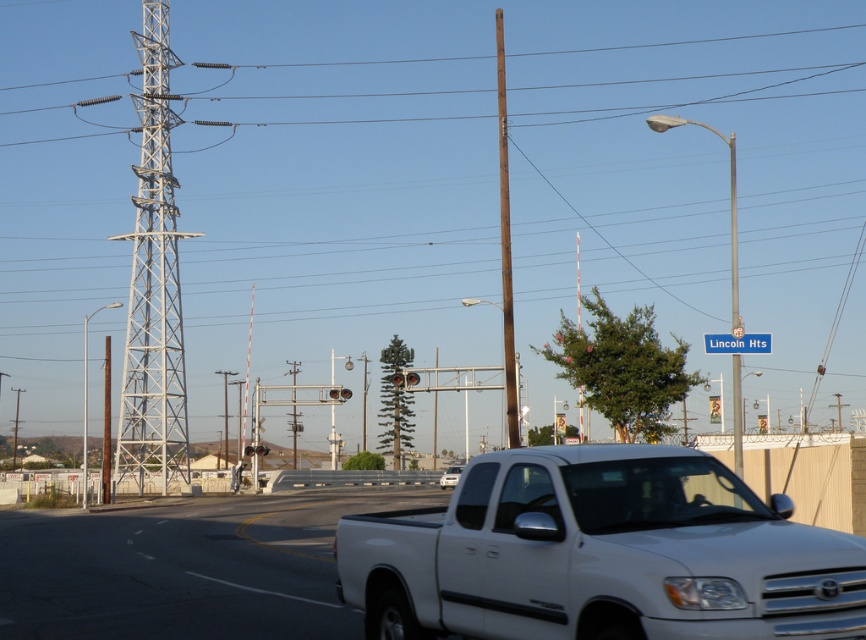
Is point (741, 616) positioned after point (718, 339)?

No, it is not.

Which is in front, point (545, 573) or point (770, 348)?

Positioned in front is point (545, 573).

Is point (615, 531) positioned after point (718, 346)?

No, it is in front of (718, 346).

Where is `white matte pickup truck at center`? Image resolution: width=866 pixels, height=640 pixels. white matte pickup truck at center is located at coordinates (600, 554).

Can you confirm if white glossy highway at lower right is positioned to the right of brown wooden pole at center?

Incorrect, white glossy highway at lower right is not on the right side of brown wooden pole at center.

Describe the element at coordinates (183, 566) in the screenshot. I see `white glossy highway at lower right` at that location.

What do you see at coordinates (183, 566) in the screenshot? I see `white glossy highway at lower right` at bounding box center [183, 566].

Image resolution: width=866 pixels, height=640 pixels. Find the location of `white glossy highway at lower right`. white glossy highway at lower right is located at coordinates (183, 566).

Is white matte pickup truck at center thinner than brown wooden pole at center?

Yes, white matte pickup truck at center is thinner than brown wooden pole at center.

Is the position of white matte pickup truck at center more distant than that of brown wooden pole at center?

Yes, it is behind brown wooden pole at center.

Where is `white matte pickup truck at center`? white matte pickup truck at center is located at coordinates (600, 554).